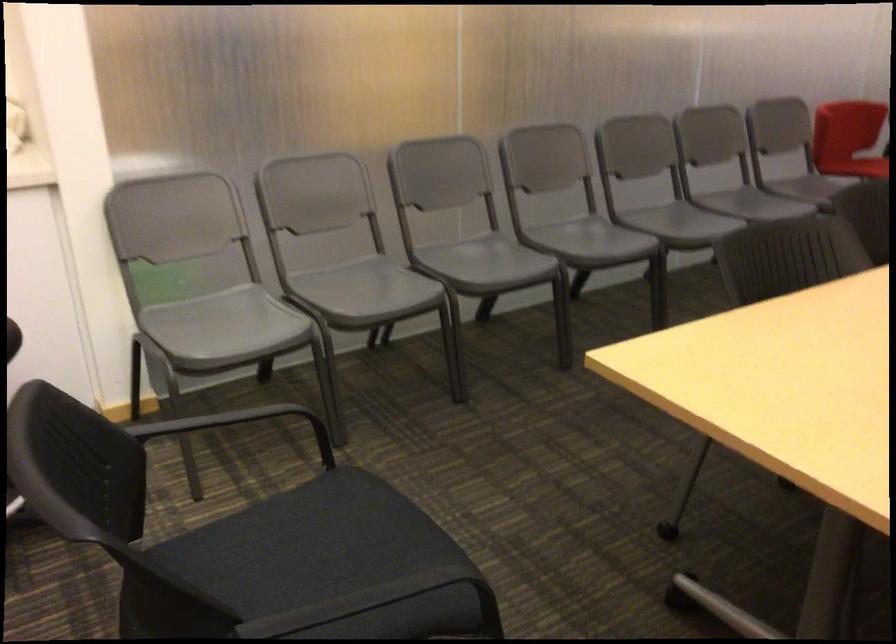
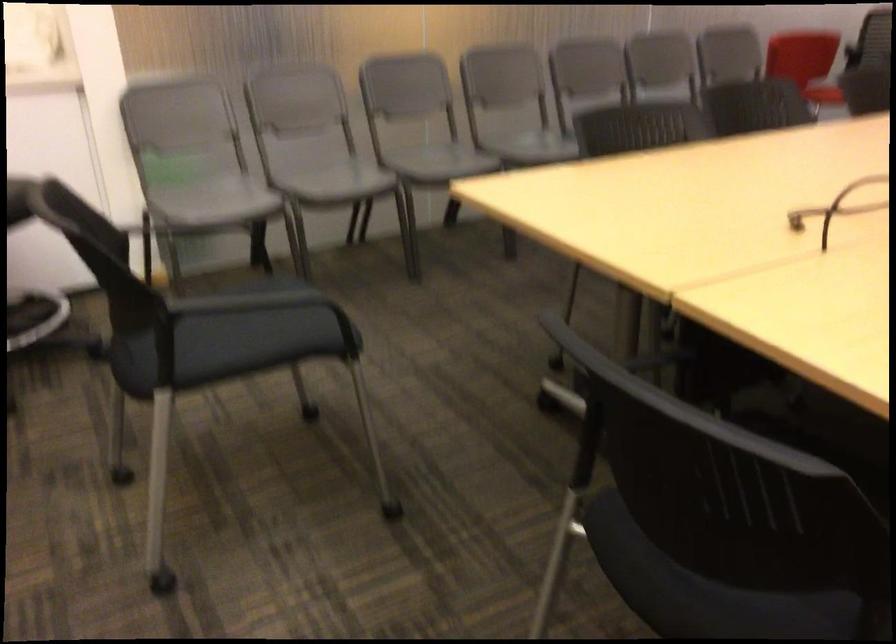
The point at (225, 327) is marked in the first image. Where is the corresponding point in the second image?

(213, 201)